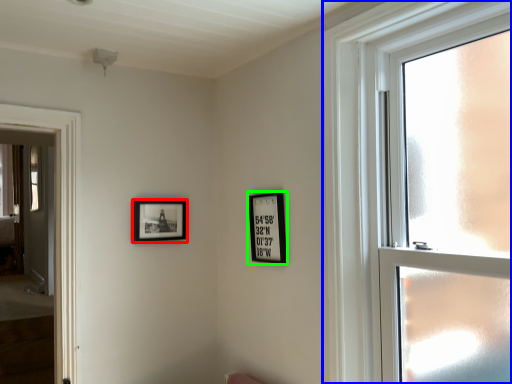
Question: Which is farther away from picture frame (highlighted by a red box)? window (highlighted by a blue box) or picture frame (highlighted by a green box)?

Choices:
 (A) window
 (B) picture frame

Answer: (A)